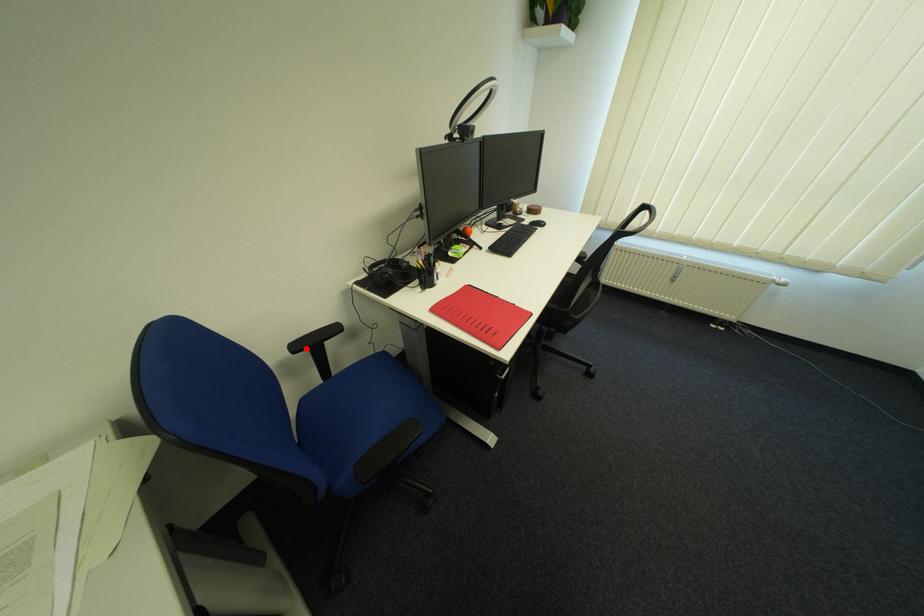
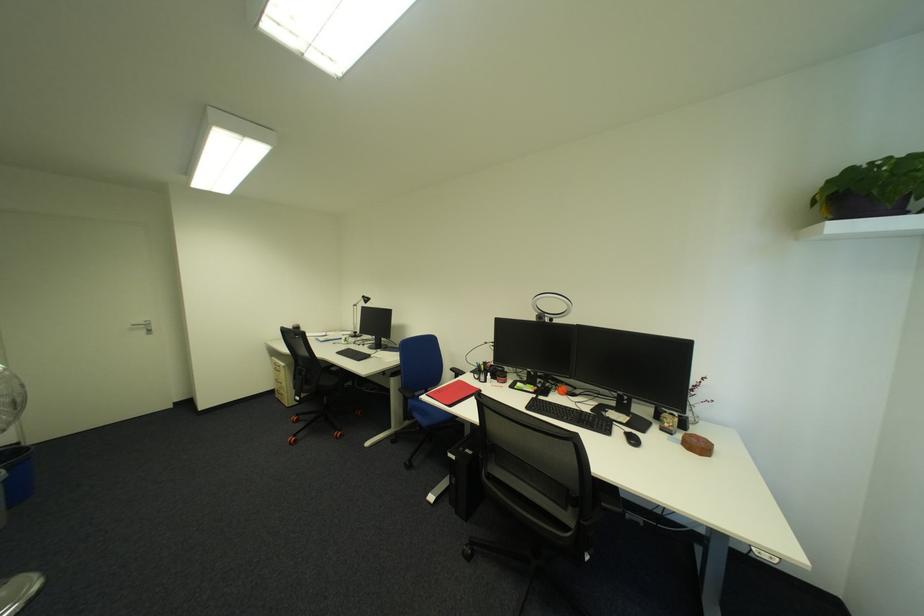
The point at the highlighted location is marked in the first image. Where is the corresponding point in the second image?

(462, 370)